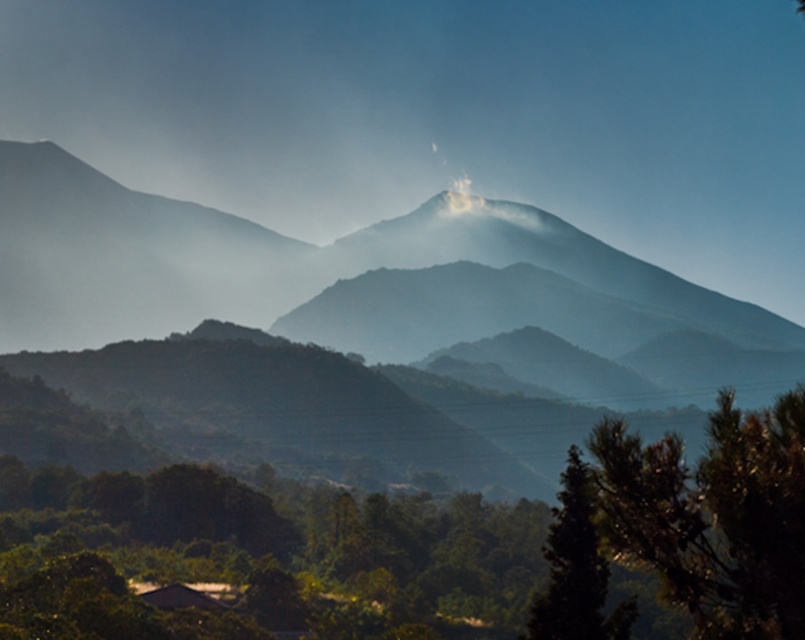
Question: Does smokey gray mountain range at center appear over green leafy tree at lower right?

Choices:
 (A) yes
 (B) no

Answer: (B)

Question: Which point is farther to the camera?

Choices:
 (A) (512, 236)
 (B) (442, 516)

Answer: (A)

Question: Can you confirm if green leafy tree at center is bigger than smokey gray mountain range at center?

Choices:
 (A) yes
 (B) no

Answer: (B)

Question: Is green leafy tree at center above smokey gray mountain range at center?

Choices:
 (A) no
 (B) yes

Answer: (A)

Question: Which of the following is the farthest from the observer?

Choices:
 (A) smokey gray mountain range at center
 (B) green matte tree at lower right
 (C) green leafy tree at lower right

Answer: (A)

Question: Which of the following is the farthest from the observer?

Choices:
 (A) (488, 205)
 (B) (682, 461)
 (C) (583, 518)
 (D) (801, 577)

Answer: (A)